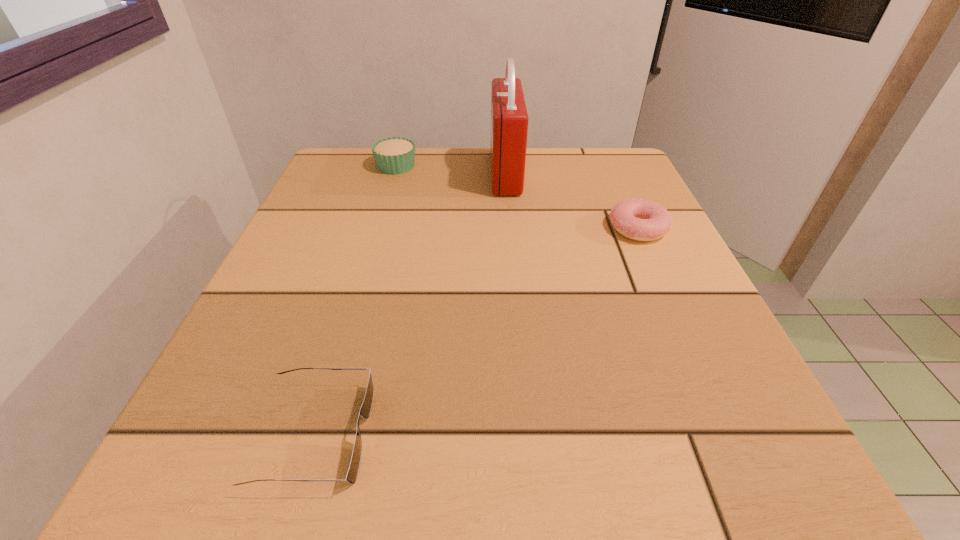
The width and height of the screenshot is (960, 540). In the image, there is a desktop. Identify the location of free space at the far edge. (544, 197).

Locate an element on the screen. vacant space at the near edge of the desktop is located at coordinates (597, 429).

The height and width of the screenshot is (540, 960). What are the coordinates of `free region at the left edge of the desktop` in the screenshot? It's located at (317, 346).

Find the location of a particular element. The width and height of the screenshot is (960, 540). vacant region at the right edge of the desktop is located at coordinates (667, 392).

In the image, there is a desktop. What are the coordinates of `vacant space at the far left corner` in the screenshot? It's located at (338, 194).

At what (x,y) coordinates should I click in order to perform the action: click on free space at the far right corner of the desktop. Please return your answer as a coordinate pair (x, y). Looking at the image, I should click on (588, 195).

The height and width of the screenshot is (540, 960). I want to click on free spot between the first-aid kit and the doughnut, so coord(572,200).

At what (x,y) coordinates should I click in order to perform the action: click on unoccupied position between the rightmost object and the nearest object. Please return your answer as a coordinate pair (x, y). Looking at the image, I should click on (476, 331).

Where is `free space between the cupcake and the doughnut`? The width and height of the screenshot is (960, 540). free space between the cupcake and the doughnut is located at coordinates (517, 197).

At what (x,y) coordinates should I click in order to perform the action: click on free space between the first-aid kit and the cupcake. Please return your answer as a coordinate pair (x, y). Looking at the image, I should click on (x=451, y=170).